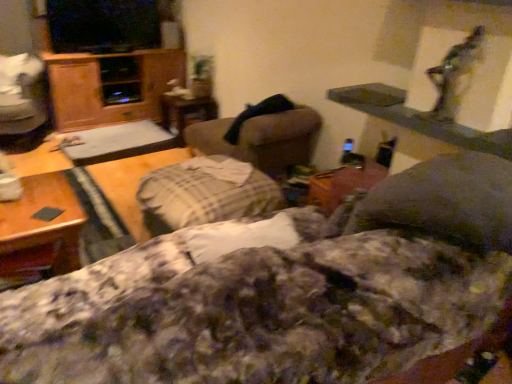
Question: Does plush beige swivel chair at center, acting as the first swivel chair starting from the front, have a lesser height compared to fluffy cotton blanket at center?

Choices:
 (A) yes
 (B) no

Answer: (A)

Question: Considering the relative positions of plush beige swivel chair at center, the second swivel chair positioned from the left, and fluffy cotton blanket at center in the image provided, is plush beige swivel chair at center, the second swivel chair positioned from the left, to the right of fluffy cotton blanket at center from the viewer's perspective?

Choices:
 (A) yes
 (B) no

Answer: (A)

Question: Is plush beige swivel chair at center, the second swivel chair positioned from the left, in front of fluffy cotton blanket at center?

Choices:
 (A) no
 (B) yes

Answer: (A)

Question: Is there a large distance between plush beige swivel chair at center, the second swivel chair positioned from the left, and fluffy cotton blanket at center?

Choices:
 (A) yes
 (B) no

Answer: (A)

Question: From a real-world perspective, is plush beige swivel chair at center, acting as the first swivel chair starting from the front, under fluffy cotton blanket at center?

Choices:
 (A) no
 (B) yes

Answer: (A)

Question: Is fluffy cotton blanket at center wider or thinner than wooden table at center, which ranks as the 3th table in left-to-right order?

Choices:
 (A) wide
 (B) thin

Answer: (A)

Question: Considering the positions of fluffy cotton blanket at center and wooden table at center, the 2th table viewed from the right, in the image, is fluffy cotton blanket at center taller or shorter than wooden table at center, the 2th table viewed from the right,?

Choices:
 (A) short
 (B) tall

Answer: (B)

Question: Considering the relative positions of fluffy cotton blanket at center and wooden table at center, which is the fourth table from front to back, in the image provided, is fluffy cotton blanket at center to the left or to the right of wooden table at center, which is the fourth table from front to back,?

Choices:
 (A) right
 (B) left

Answer: (A)

Question: From a real-world perspective, is fluffy cotton blanket at center physically located above or below wooden table at center, which ranks as the 3th table in left-to-right order?

Choices:
 (A) above
 (B) below

Answer: (A)

Question: Do you think plush beige swivel chair at center, acting as the first swivel chair starting from the front, is within wooden table at center, acting as the fourth table starting from the right, or outside of it?

Choices:
 (A) outside
 (B) inside

Answer: (A)

Question: From a real-world perspective, relative to wooden table at center, acting as the fourth table starting from the right, is plush beige swivel chair at center, positioned as the first swivel chair in right-to-left order, vertically above or below?

Choices:
 (A) above
 (B) below

Answer: (A)

Question: From their relative heights in the image, would you say plush beige swivel chair at center, the second swivel chair positioned from the left, is taller or shorter than wooden table at center, acting as the fourth table starting from the right?

Choices:
 (A) tall
 (B) short

Answer: (A)

Question: Looking at their shapes, would you say plush beige swivel chair at center, positioned as the first swivel chair in right-to-left order, is wider or thinner than wooden table at center, arranged as the first table when viewed from the left?

Choices:
 (A) wide
 (B) thin

Answer: (A)

Question: From their relative heights in the image, would you say wooden cabinet at left is taller or shorter than wooden table at center, positioned as the second table in back-to-front order?

Choices:
 (A) short
 (B) tall

Answer: (B)

Question: Considering the positions of point (118, 72) and point (62, 165), is point (118, 72) closer or farther from the camera than point (62, 165)?

Choices:
 (A) closer
 (B) farther

Answer: (B)